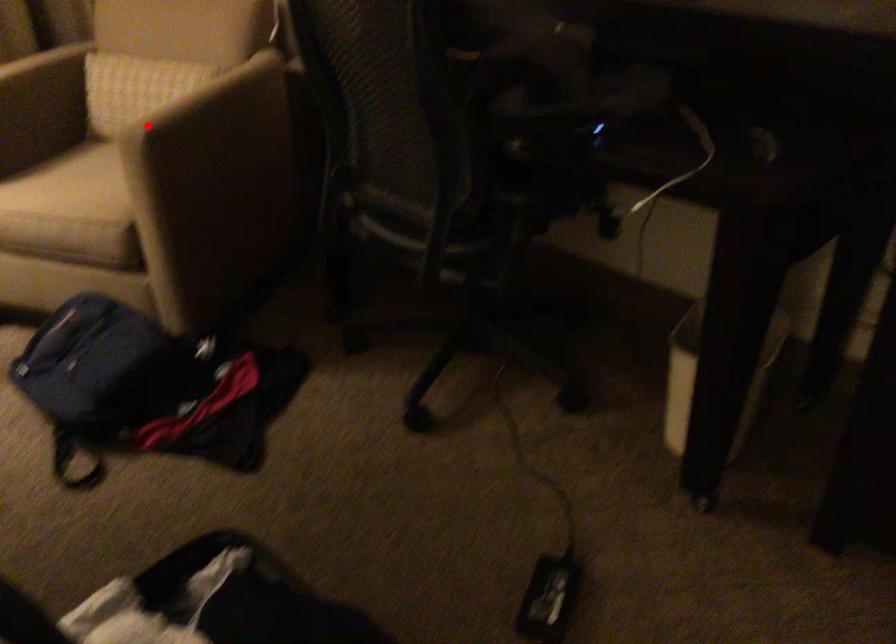
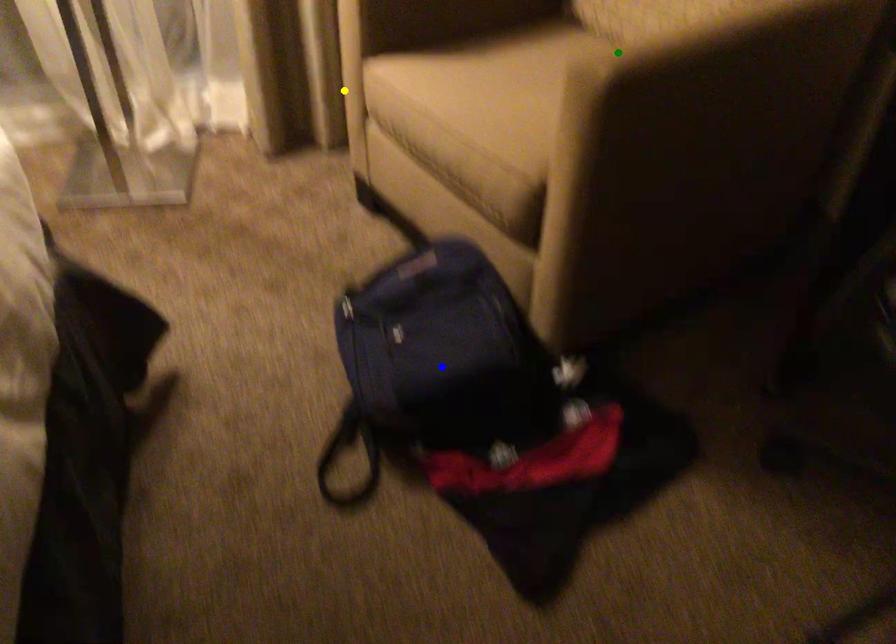
Question: I am providing you with two images of the same scene from different viewpoints. A red point is marked on the first image. You are given multiple points on the second image. Which point in image 2 is actually the same real-world point as the red point in image 1?

Choices:
 (A) green point
 (B) yellow point
 (C) blue point

Answer: (A)